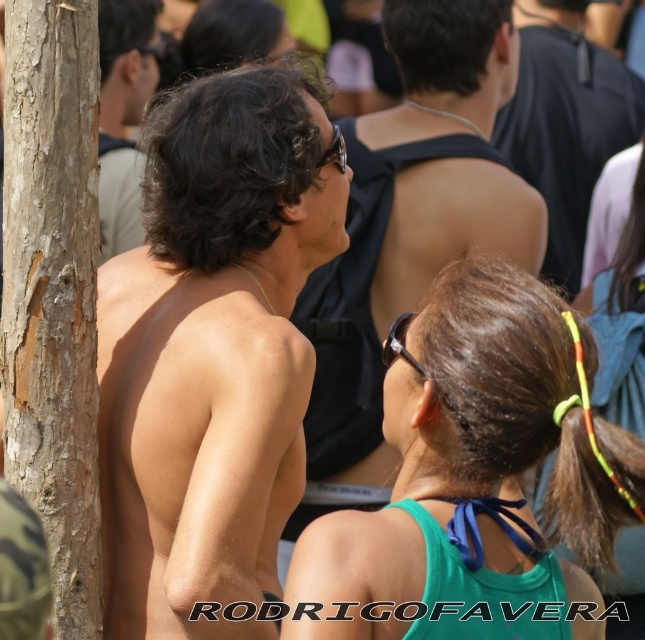
Between point (328, 580) and point (580, 180), which one is positioned in front?

Point (328, 580) is in front.

Is point (577, 378) in front of point (541, 92)?

Yes, it is in front of point (541, 92).

The image size is (645, 640). What are the coordinates of `green fabric ponytail at upper right` in the screenshot? It's located at (477, 477).

Is matte black tank top at center taller than black matte tank top at upper center?

Correct, matte black tank top at center is much taller as black matte tank top at upper center.

Measure the distance between matte black tank top at center and black matte tank top at upper center.

A distance of 6.42 feet exists between matte black tank top at center and black matte tank top at upper center.

Describe the element at coordinates (408, 230) in the screenshot. This screenshot has height=640, width=645. I see `matte black tank top at center` at that location.

The width and height of the screenshot is (645, 640). In order to click on matte black tank top at center in this screenshot , I will do `click(408, 230)`.

Can you confirm if brown rough bark at left is wider than black matte tank top at upper center?

No.

Between brown rough bark at left and black matte tank top at upper center, which one is positioned lower?

brown rough bark at left is below.

Does point (59, 368) come closer to viewer compared to point (610, 154)?

Yes, it is in front of point (610, 154).

I want to click on brown rough bark at left, so point(54,291).